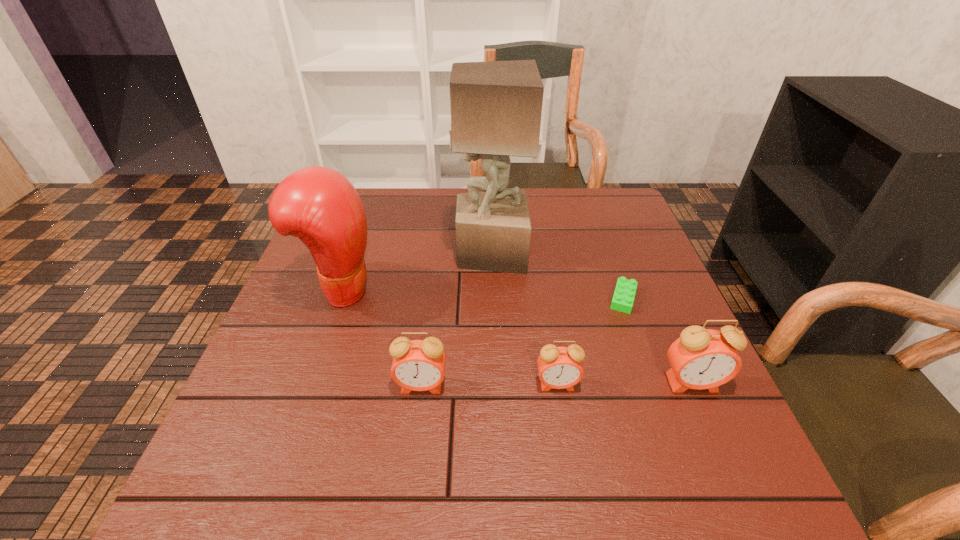
At what (x,y) coordinates should I click in order to perform the action: click on the leftmost alarm clock. Please return your answer as a coordinate pair (x, y). This screenshot has width=960, height=540. Looking at the image, I should click on (418, 365).

Where is `the third shortest object`? This screenshot has height=540, width=960. the third shortest object is located at coordinates (418, 365).

Identify the location of the second alarm clock from left to right. (559, 367).

Locate an element on the screen. This screenshot has width=960, height=540. the shortest alarm clock is located at coordinates (559, 367).

Locate an element on the screen. The image size is (960, 540). the rightmost alarm clock is located at coordinates (701, 358).

Where is `the tallest object`? The height and width of the screenshot is (540, 960). the tallest object is located at coordinates (496, 106).

You are a GUI agent. You are given a task and a screenshot of the screen. Output one action in this format:
    pyautogui.click(x=<x>, y=<y>)
    Task: Click on the leftmost object
    The image size is (960, 540).
    Given the screenshot: What is the action you would take?
    pyautogui.click(x=319, y=205)

In order to click on the fifth shortest object in this screenshot , I will do `click(319, 205)`.

The image size is (960, 540). Identify the location of the shortest object. (623, 298).

Locate an element on the screen. The height and width of the screenshot is (540, 960). vacant point located on the face of the leftmost alarm clock is located at coordinates (415, 440).